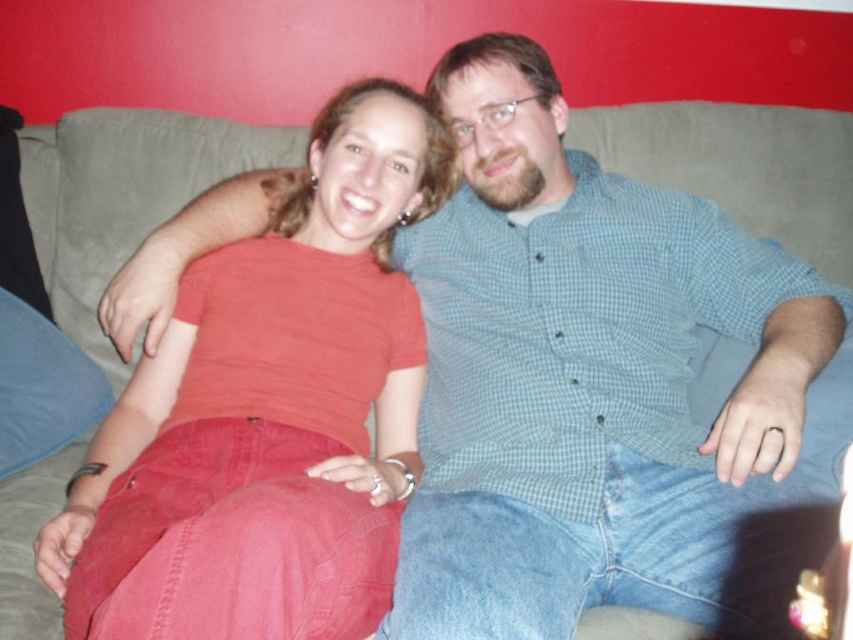
Question: Which of the following is the farthest from the observer?

Choices:
 (A) (351, 337)
 (B) (599, 211)

Answer: (B)

Question: Is green checkered shirt at center bigger than matte red shirt at center?

Choices:
 (A) yes
 (B) no

Answer: (A)

Question: Does green checkered shirt at center have a greater width compared to matte red shirt at center?

Choices:
 (A) no
 (B) yes

Answer: (B)

Question: Is green checkered shirt at center below matte red shirt at center?

Choices:
 (A) no
 (B) yes

Answer: (A)

Question: Which object is closer to the camera taking this photo?

Choices:
 (A) green checkered shirt at center
 (B) matte red shirt at center

Answer: (B)